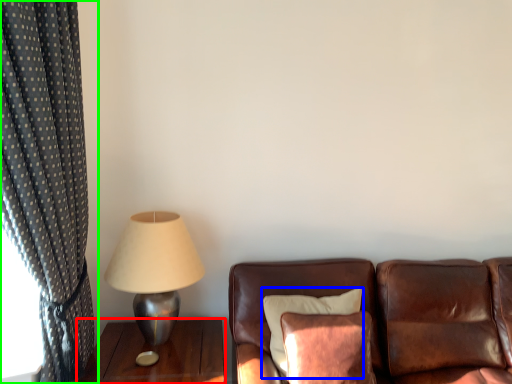
Question: Estimate the real-world distances between objects in this image. Which object is closer to table (highlighted by a red box), pillow (highlighted by a blue box) or curtain (highlighted by a green box)?

Choices:
 (A) pillow
 (B) curtain

Answer: (A)